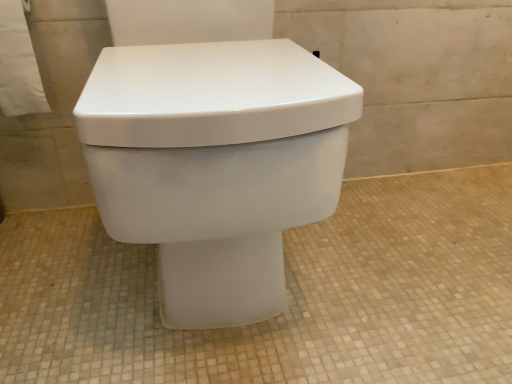
Locate an element on the screen. The image size is (512, 384). white matte toilet at center is located at coordinates (288, 295).

Image resolution: width=512 pixels, height=384 pixels. In order to click on white glossy toilet at center in this screenshot , I will do `click(215, 164)`.

Identify the location of white matte toilet at center. (288, 295).

Would you say white matte toilet at center is a long distance from white glossy toilet at center?

No, white matte toilet at center is not far from white glossy toilet at center.

The image size is (512, 384). I want to click on toilet above the white matte toilet at center (from the image's perspective), so click(x=215, y=164).

What's the angular difference between white matte toilet at center and white glossy toilet at center's facing directions?

1.42 degrees.

Can you confirm if white matte toilet at center is taller than white glossy toilet at center?

No.

Between white paper towel at upper left and white glossy toilet at center, which one has more height?

white glossy toilet at center.

Which object is thinner, white paper towel at upper left or white glossy toilet at center?

white paper towel at upper left is thinner.

Who is bigger, white paper towel at upper left or white glossy toilet at center?

Bigger between the two is white glossy toilet at center.

Is white paper towel at upper left outside of white glossy toilet at center?

white paper towel at upper left is positioned outside white glossy toilet at center.

Considering the relative positions of white paper towel at upper left and white matte toilet at center in the image provided, is white paper towel at upper left to the right of white matte toilet at center from the viewer's perspective?

Incorrect, white paper towel at upper left is not on the right side of white matte toilet at center.

From the image's perspective, is white paper towel at upper left over white matte toilet at center?

Correct, white paper towel at upper left appears higher than white matte toilet at center in the image.

In the image, is white paper towel at upper left positioned in front of or behind white matte toilet at center?

white paper towel at upper left is behind white matte toilet at center.

Does white glossy toilet at center turn towards white paper towel at upper left?

No, white glossy toilet at center is not turned towards white paper towel at upper left.

Between white glossy toilet at center and white paper towel at upper left, which one has less height?

white paper towel at upper left.

Considering the sizes of objects white glossy toilet at center and white paper towel at upper left in the image provided, who is smaller, white glossy toilet at center or white paper towel at upper left?

white paper towel at upper left.

Considering the positions of objects white glossy toilet at center and white paper towel at upper left in the image provided, who is more to the right, white glossy toilet at center or white paper towel at upper left?

From the viewer's perspective, white glossy toilet at center appears more on the right side.

Between white matte toilet at center and white paper towel at upper left, which one is positioned behind?

white paper towel at upper left is further away from the camera.

Considering the relative sizes of white matte toilet at center and white paper towel at upper left in the image provided, is white matte toilet at center wider than white paper towel at upper left?

Yes, white matte toilet at center is wider than white paper towel at upper left.

Between point (367, 289) and point (9, 9), which one is positioned in front?

Positioned in front is point (9, 9).

In the scene shown: Is white matte toilet at center far from white paper towel at upper left?

No.

In terms of height, does white glossy toilet at center look taller or shorter compared to white matte toilet at center?

Clearly, white glossy toilet at center is taller compared to white matte toilet at center.

Is white glossy toilet at center oriented away from white matte toilet at center?

No, white matte toilet at center is not at the back of white glossy toilet at center.

From a real-world perspective, is white glossy toilet at center physically located above or below white matte toilet at center?

Clearly, from a real-world perspective, white glossy toilet at center is above white matte toilet at center.

Is white glossy toilet at center situated inside white matte toilet at center or outside?

white glossy toilet at center is not enclosed by white matte toilet at center.

In the image, there is a white glossy toilet at center. Identify the location of concrete below it (from a real-world perspective). (288, 295).

Locate an element on the screen. toilet paper behind the white glossy toilet at center is located at coordinates (18, 64).

Based on their spatial positions, is white glossy toilet at center or white matte toilet at center further from white paper towel at upper left?

white matte toilet at center is further to white paper towel at upper left.

Estimate the real-world distances between objects in this image. Which object is closer to white matte toilet at center, white glossy toilet at center or white paper towel at upper left?

white glossy toilet at center.

Which object lies further to the anchor point white matte toilet at center, white paper towel at upper left or white glossy toilet at center?

The object further to white matte toilet at center is white paper towel at upper left.

Estimate the real-world distances between objects in this image. Which object is further from white paper towel at upper left, white matte toilet at center or white glossy toilet at center?

white matte toilet at center.

From the image, which object appears to be nearer to white glossy toilet at center, white paper towel at upper left or white matte toilet at center?

white matte toilet at center.

From the image, which object appears to be nearer to white glossy toilet at center, white matte toilet at center or white paper towel at upper left?

The object closer to white glossy toilet at center is white matte toilet at center.

Find the location of a particular element. toilet between white paper towel at upper left and white matte toilet at center in the horizontal direction is located at coordinates (215, 164).